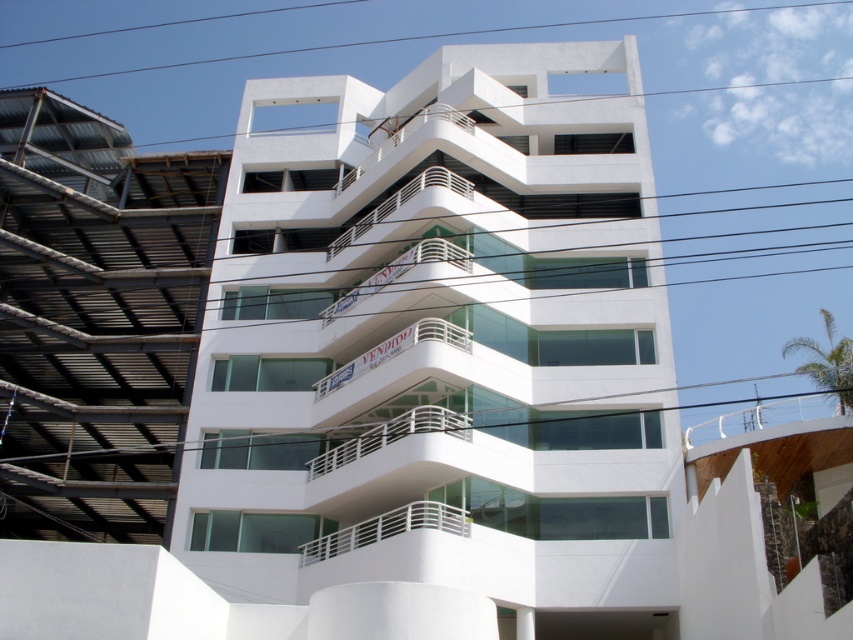
Question: Which of the following is the farthest from the observer?

Choices:
 (A) white glass balcony at center
 (B) white metal railing at center

Answer: (B)

Question: Can you confirm if white glass balcony at center is positioned to the right of white metal railing at center?

Choices:
 (A) yes
 (B) no

Answer: (A)

Question: Is white glass balcony at center smaller than white metal railing at center?

Choices:
 (A) yes
 (B) no

Answer: (B)

Question: In this image, where is white glass balcony at center located relative to white metal railing at center?

Choices:
 (A) left
 (B) right

Answer: (B)

Question: Which point is farther to the camera?

Choices:
 (A) pyautogui.click(x=412, y=513)
 (B) pyautogui.click(x=270, y=529)

Answer: (B)